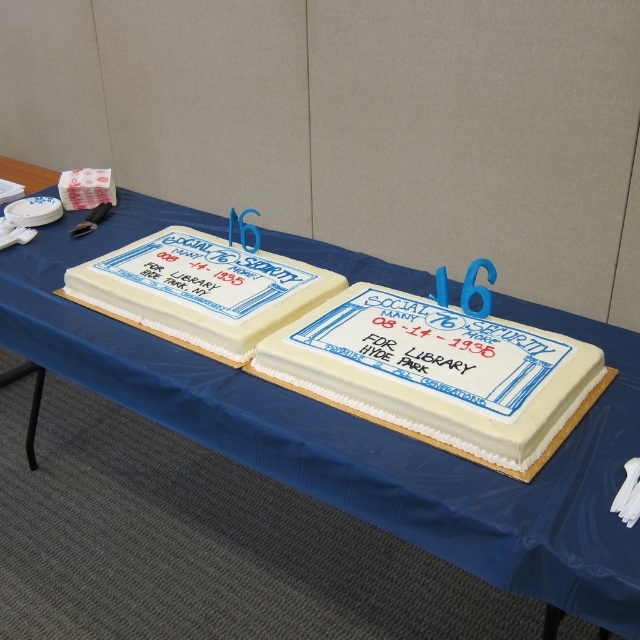
Which is behind, point (435, 394) or point (209, 305)?

The point (209, 305) is more distant.

How much distance is there between white frosted cake at center and white fondant cake at left?

white frosted cake at center and white fondant cake at left are 11.83 inches apart.

Is point (346, 300) positioned before point (202, 236)?

Yes, point (346, 300) is closer to viewer.

Identify the location of white frosted cake at center. The width and height of the screenshot is (640, 640). (438, 374).